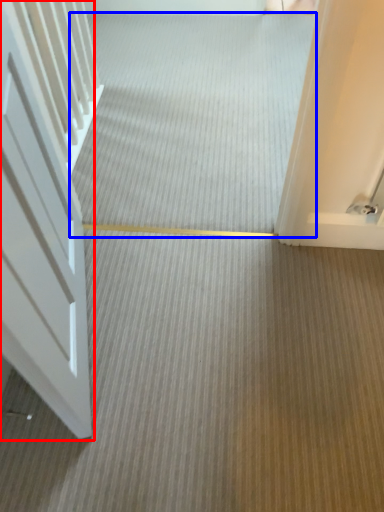
Question: Which point is closer to the camera, door (highlighted by a red box) or plain (highlighted by a blue box)?

Choices:
 (A) door
 (B) plain

Answer: (A)